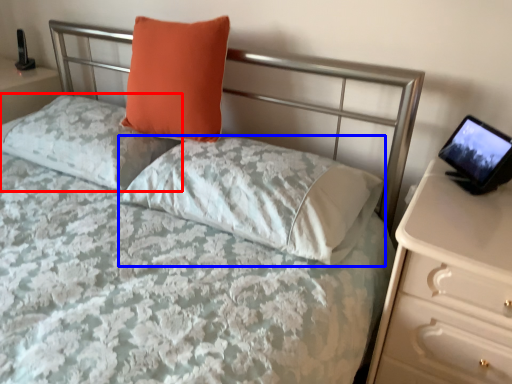
Question: Which object is further to the camera taking this photo, pillow (highlighted by a red box) or pillow (highlighted by a blue box)?

Choices:
 (A) pillow
 (B) pillow

Answer: (A)